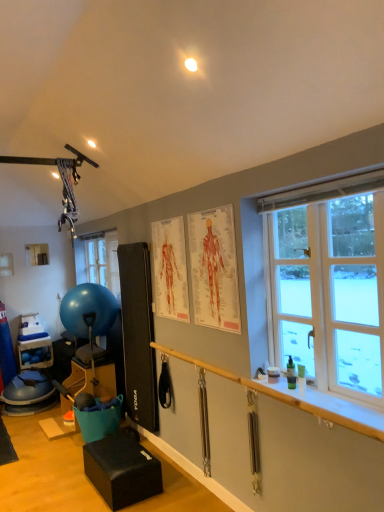
Where is `white plastic window sill at lower right`? Image resolution: width=384 pixels, height=512 pixels. white plastic window sill at lower right is located at coordinates (322, 405).

The height and width of the screenshot is (512, 384). Describe the element at coordinates (322, 405) in the screenshot. I see `white plastic window sill at lower right` at that location.

Locate an element on the screen. This screenshot has height=512, width=384. wooden rail at lower right is located at coordinates (296, 439).

In order to click on blue rubber ball at left in this screenshot , I will do `click(88, 310)`.

What do you see at coordinates (35, 353) in the screenshot? I see `blue plastic bucket at lower left` at bounding box center [35, 353].

Where is `white glass window at right`? The image size is (384, 512). white glass window at right is located at coordinates (328, 283).

In the scene shown: From a real-world perspective, between matte black exercise ball at left, which is the 2th furniture from right to left, and white glass window at right, who is vertically lower?

matte black exercise ball at left, which is the 2th furniture from right to left, from a real-world perspective.

Are matte black exercise ball at left, which is the 2th furniture from right to left, and white glass window at right beside each other?

No, matte black exercise ball at left, which is the 2th furniture from right to left, is not touching white glass window at right.

Locate an element on the screen. This screenshot has width=384, height=512. window in front of the matte black exercise ball at left, which is the first furniture in left-to-right order is located at coordinates (328, 283).

Is matte black exercise ball at left, which is the 2th furniture from right to left, positioned with its back to white glass window at right?

No.

Is white plastic window sill at lower right aimed at black leather cushion at lower center, marked as the 2th furniture in a left-to-right arrangement?

No, white plastic window sill at lower right does not turn towards black leather cushion at lower center, marked as the 2th furniture in a left-to-right arrangement.

Is white plastic window sill at lower right far away from black leather cushion at lower center, acting as the 2th furniture starting from the back?

Yes, white plastic window sill at lower right is far from black leather cushion at lower center, acting as the 2th furniture starting from the back.

From the image's perspective, which one is positioned higher, white plastic window sill at lower right or black leather cushion at lower center, marked as the 2th furniture in a left-to-right arrangement?

white plastic window sill at lower right, from the image's perspective.

Is black leather cushion at lower center, which ranks as the first furniture in right-to-left order, located within white plastic window sill at lower right?

Actually, black leather cushion at lower center, which ranks as the first furniture in right-to-left order, is outside white plastic window sill at lower right.

From their relative heights in the image, would you say black leather cushion at lower center, which is the first furniture in front-to-back order, is taller or shorter than blue plastic bucket at lower left?

In the image, black leather cushion at lower center, which is the first furniture in front-to-back order, appears to be shorter than blue plastic bucket at lower left.

Can we say black leather cushion at lower center, which ranks as the first furniture in right-to-left order, lies outside blue plastic bucket at lower left?

Indeed, black leather cushion at lower center, which ranks as the first furniture in right-to-left order, is completely outside blue plastic bucket at lower left.

Does black leather cushion at lower center, which ranks as the first furniture in right-to-left order, have a lesser width compared to blue plastic bucket at lower left?

Incorrect, the width of black leather cushion at lower center, which ranks as the first furniture in right-to-left order, is not less than that of blue plastic bucket at lower left.

Is black leather cushion at lower center, acting as the 2th furniture starting from the back, next to blue plastic bucket at lower left?

No.

Looking at the image, does blue plastic bucket at lower left seem bigger or smaller compared to white plastic window sill at lower right?

Clearly, blue plastic bucket at lower left is larger in size than white plastic window sill at lower right.

From a real-world perspective, is blue plastic bucket at lower left physically below white plastic window sill at lower right?

Indeed, from a real-world perspective, blue plastic bucket at lower left is positioned beneath white plastic window sill at lower right.

Which is behind, blue plastic bucket at lower left or white plastic window sill at lower right?

blue plastic bucket at lower left is behind.

Considering the relative sizes of blue plastic bucket at lower left and white plastic window sill at lower right in the image provided, is blue plastic bucket at lower left wider than white plastic window sill at lower right?

Indeed, blue plastic bucket at lower left has a greater width compared to white plastic window sill at lower right.

Is black leather cushion at lower center, which ranks as the first furniture in right-to-left order, inside the boundaries of white glass window at right, or outside?

black leather cushion at lower center, which ranks as the first furniture in right-to-left order, is spatially situated outside white glass window at right.

Locate an element on the screen. window to the right of black leather cushion at lower center, which is the first furniture in front-to-back order is located at coordinates (328, 283).

Is black leather cushion at lower center, marked as the 2th furniture in a left-to-right arrangement, positioned far away from white glass window at right?

Yes, black leather cushion at lower center, marked as the 2th furniture in a left-to-right arrangement, and white glass window at right are located far from each other.

How much distance is there between black leather cushion at lower center, which ranks as the first furniture in right-to-left order, and white glass window at right?

black leather cushion at lower center, which ranks as the first furniture in right-to-left order, and white glass window at right are 5.78 feet apart from each other.

Is blue plastic bucket at lower left situated inside wooden rail at lower right or outside?

blue plastic bucket at lower left is located beyond the bounds of wooden rail at lower right.

From a real-world perspective, which is physically below, blue plastic bucket at lower left or wooden rail at lower right?

From a 3D spatial view, blue plastic bucket at lower left is below.

Is blue plastic bucket at lower left aimed at wooden rail at lower right?

Yes, blue plastic bucket at lower left is aimed at wooden rail at lower right.

Is white plastic window sill at lower right positioned behind blue rubber ball at left?

No, it is not.

From the image's perspective, is white plastic window sill at lower right above blue rubber ball at left?

Incorrect, from the image's perspective, white plastic window sill at lower right is lower than blue rubber ball at left.

Can you confirm if white plastic window sill at lower right is smaller than blue rubber ball at left?

Indeed, white plastic window sill at lower right has a smaller size compared to blue rubber ball at left.

Identify the location of furniture that is the 1st one below the white glass window at right (from a real-world perspective). This screenshot has height=512, width=384. (92, 380).

The width and height of the screenshot is (384, 512). In order to click on window sill located above the black leather cushion at lower center, marked as the 2th furniture in a left-to-right arrangement (from a real-world perspective) in this screenshot , I will do `click(322, 405)`.

Which object lies nearer to the anchor point wooden rail at lower right, white glass window at right or blue rubber ball at left?

white glass window at right is closer to wooden rail at lower right.

Looking at the image, which one is located further to blue plastic bucket at lower left, black leather cushion at lower center, marked as the 2th furniture in a left-to-right arrangement, or wooden rail at lower right?

Based on the image, wooden rail at lower right appears to be further to blue plastic bucket at lower left.

When comparing their distances from black leather cushion at lower center, which is the first furniture in front-to-back order, does matte black exercise ball at left, arranged as the 2th furniture when viewed from the front, or white glass window at right seem closer?

The object closer to black leather cushion at lower center, which is the first furniture in front-to-back order, is matte black exercise ball at left, arranged as the 2th furniture when viewed from the front.

Based on their spatial positions, is blue rubber ball at left or black leather cushion at lower center, which is the first furniture in front-to-back order, closer to white plastic window sill at lower right?

black leather cushion at lower center, which is the first furniture in front-to-back order, lies closer to white plastic window sill at lower right than the other object.

Which object lies further to the anchor point white plastic window sill at lower right, blue plastic bucket at lower left or white glass window at right?

The object further to white plastic window sill at lower right is blue plastic bucket at lower left.

Considering their positions, is matte black exercise ball at left, which is the first furniture from back to front, positioned further to blue rubber ball at left than white glass window at right?

white glass window at right is positioned further to the anchor blue rubber ball at left.

From the image, which object appears to be nearer to matte black exercise ball at left, arranged as the 2th furniture when viewed from the front, white glass window at right or blue plastic bucket at lower left?

blue plastic bucket at lower left lies closer to matte black exercise ball at left, arranged as the 2th furniture when viewed from the front, than the other object.

From the image, which object appears to be nearer to blue plastic bucket at lower left, white glass window at right or black leather cushion at lower center, which is the first furniture in front-to-back order?

black leather cushion at lower center, which is the first furniture in front-to-back order, is positioned closer to the anchor blue plastic bucket at lower left.

Find the location of a particular element. The height and width of the screenshot is (512, 384). furniture between blue rubber ball at left and blue plastic bucket at lower left in the front-back direction is located at coordinates (92, 380).

I want to click on furniture located between white glass window at right and matte black exercise ball at left, which is the first furniture from back to front, in the depth direction, so click(122, 470).

The width and height of the screenshot is (384, 512). In order to click on furniture between black leather cushion at lower center, marked as the 2th furniture in a left-to-right arrangement, and blue plastic bucket at lower left, along the z-axis in this screenshot , I will do (92, 380).

This screenshot has height=512, width=384. Identify the location of ball between white plastic window sill at lower right and blue plastic bucket at lower left along the z-axis. (88, 310).